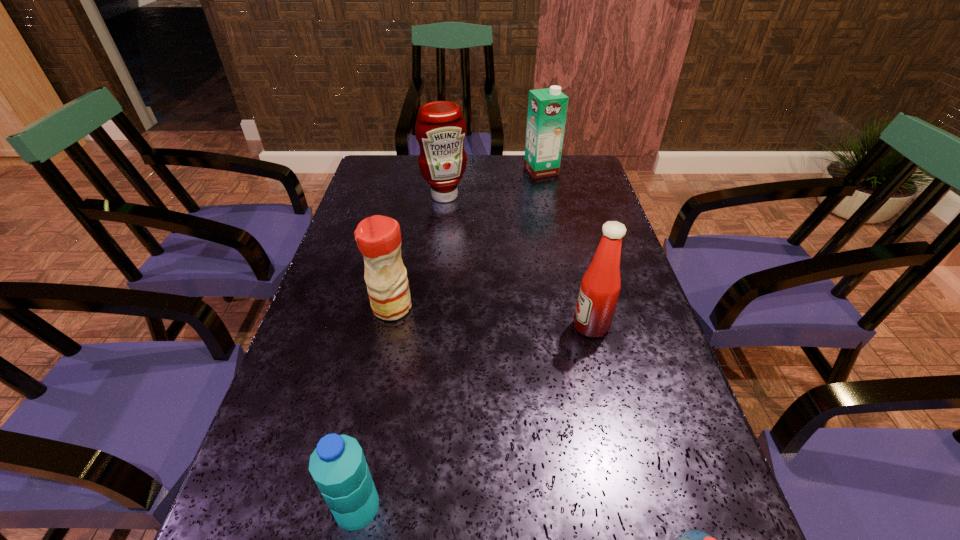
You are a GUI agent. You are given a task and a screenshot of the screen. Output one action in this format:
    pyautogui.click(x=<x>, y=<y>)
    Task: Click on the fifth nearest object
    This screenshot has height=540, width=960.
    Given the screenshot: What is the action you would take?
    pyautogui.click(x=440, y=129)

You are a GUI agent. You are given a task and a screenshot of the screen. Output one action in this format:
    pyautogui.click(x=<x>, y=<y>)
    Task: Click on the carton
    The image size is (960, 540).
    Given the screenshot: What is the action you would take?
    pyautogui.click(x=547, y=108)

Locate an element on the screen. The width and height of the screenshot is (960, 540). the rightmost condiment is located at coordinates (601, 283).

This screenshot has height=540, width=960. What are the coordinates of `the second shortest object` in the screenshot? It's located at (338, 466).

Image resolution: width=960 pixels, height=540 pixels. I want to click on the second nearest object, so click(338, 466).

Locate an element on the screen. The width and height of the screenshot is (960, 540). vacant space located 0.100m on the left of the farthest condiment is located at coordinates (391, 196).

Find the location of a particular element. free region located on the left of the farthest object is located at coordinates (475, 170).

Find the location of a particular element. This screenshot has width=960, height=540. free space located 0.060m on the front-facing side of the rightmost condiment is located at coordinates (546, 326).

I want to click on blank space located on the front-facing side of the rightmost condiment, so click(489, 326).

Find the location of `blank space located on the front-facing side of the rightmost condiment`. blank space located on the front-facing side of the rightmost condiment is located at coordinates (551, 326).